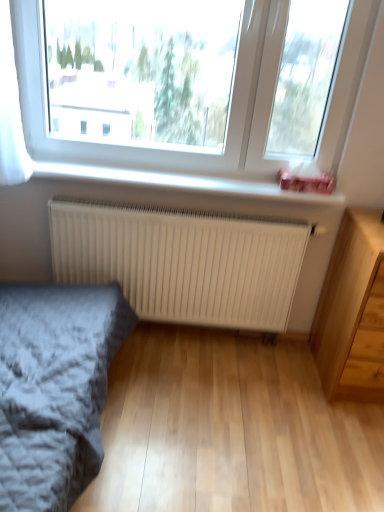
You are a GUI agent. You are given a task and a screenshot of the screen. Output one action in this format:
    pyautogui.click(x=<x>, y=<y>)
    Task: Click on the free space below white matte radiator at center (from a real-world perspective)
    This screenshot has width=384, height=512.
    Given the screenshot: What is the action you would take?
    pyautogui.click(x=204, y=338)